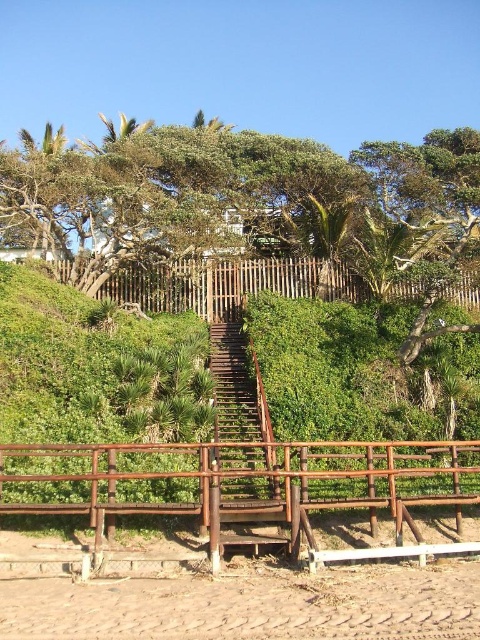
Is brown textured sand at lower center taller than rustic wood railing at center?

Incorrect, brown textured sand at lower center's height is not larger of rustic wood railing at center's.

Between brown textured sand at lower center and rustic wood railing at center, which one appears on the left side from the viewer's perspective?

rustic wood railing at center

This screenshot has height=640, width=480. In order to click on brown textured sand at lower center in this screenshot , I will do `click(228, 596)`.

At what (x,y) coordinates should I click in order to perform the action: click on brown textured sand at lower center. Please return your answer as a coordinate pair (x, y). The width and height of the screenshot is (480, 640). Looking at the image, I should click on (228, 596).

Looking at this image, does brown textured sand at lower center have a lesser width compared to rusty metal stairs at center?

In fact, brown textured sand at lower center might be wider than rusty metal stairs at center.

Does brown textured sand at lower center lie in front of rusty metal stairs at center?

Yes, brown textured sand at lower center is in front of rusty metal stairs at center.

Who is more distant from viewer, (454, 625) or (235, 492)?

Positioned behind is point (235, 492).

What are the coordinates of `brown textured sand at lower center` in the screenshot? It's located at (228, 596).

The width and height of the screenshot is (480, 640). Describe the element at coordinates (241, 483) in the screenshot. I see `rustic wood railing at center` at that location.

Between rustic wood railing at center and rusty metal stairs at center, which one has more height?

Standing taller between the two is rustic wood railing at center.

Is point (211, 532) more distant than point (226, 397)?

No.

The width and height of the screenshot is (480, 640). In order to click on rustic wood railing at center in this screenshot , I will do `click(241, 483)`.